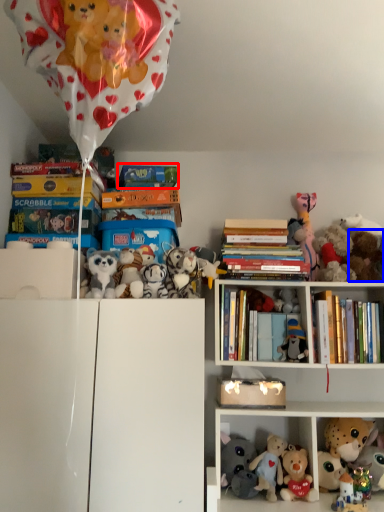
Question: Which of the following is the farthest to the observer, book (highlighted by a red box) or toy (highlighted by a blue box)?

Choices:
 (A) book
 (B) toy

Answer: (A)